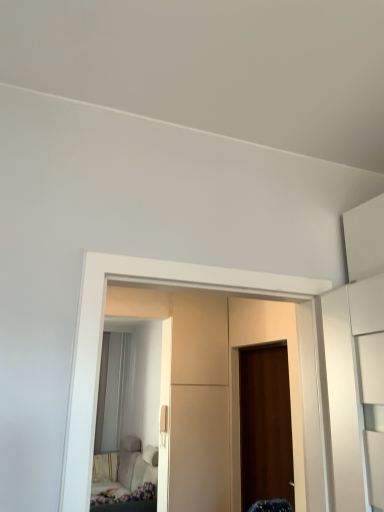
Locate an element on the screen. This screenshot has height=512, width=384. white fabric couch at lower left is located at coordinates (123, 475).

The width and height of the screenshot is (384, 512). What do you see at coordinates (123, 475) in the screenshot?
I see `white fabric couch at lower left` at bounding box center [123, 475].

Locate an element on the screen. The image size is (384, 512). white fabric couch at lower left is located at coordinates (123, 475).